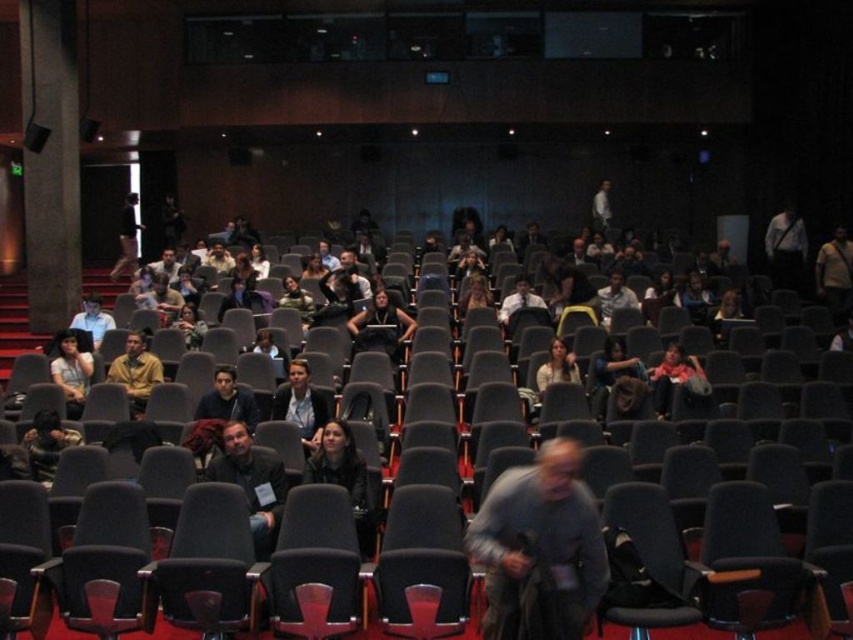
You are standing at point (227,401) in the auditorium. What object is located exactly at this point?

The dark blue jacket at center is located exactly at point (227,401).

You are sitting in the back row of the auditorium and want to see the presenter on the stage. There is a dark gray jacket at center and a white shirt at upper center in your line of sight. Which object is blocking your view more due to its height?

The white shirt at upper center is taller than the dark gray jacket at center, so it is blocking your view more due to its height.